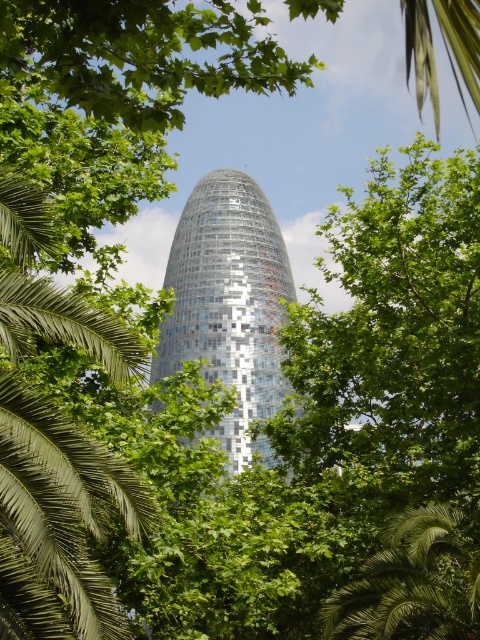
You are standing in front of the shiny glass tower at center and want to take a photo of it. However, the green leafy palm tree at left might block your view. Based on their heights, will the palm tree block the view of the tower?

The green leafy palm tree at left is not as tall as the shiny glass tower at center, so it will not block the view of the tower.

You are standing in front of the modern cylindrical building with the shimmering facade. You see two points marked on the building surface. The first point is at coordinate point (x=25, y=342) and the second is at point (x=192, y=196). If you want to touch both points starting from the nearest one, which point should you reach first?

You should reach point (x=25, y=342) first because it is closer to the camera than point (x=192, y=196), so it is nearer to your current position.